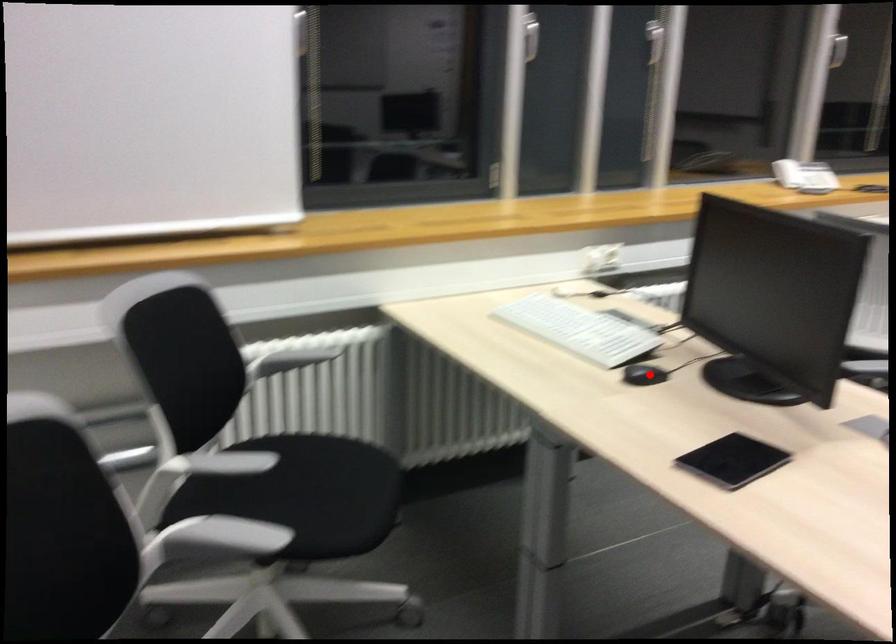
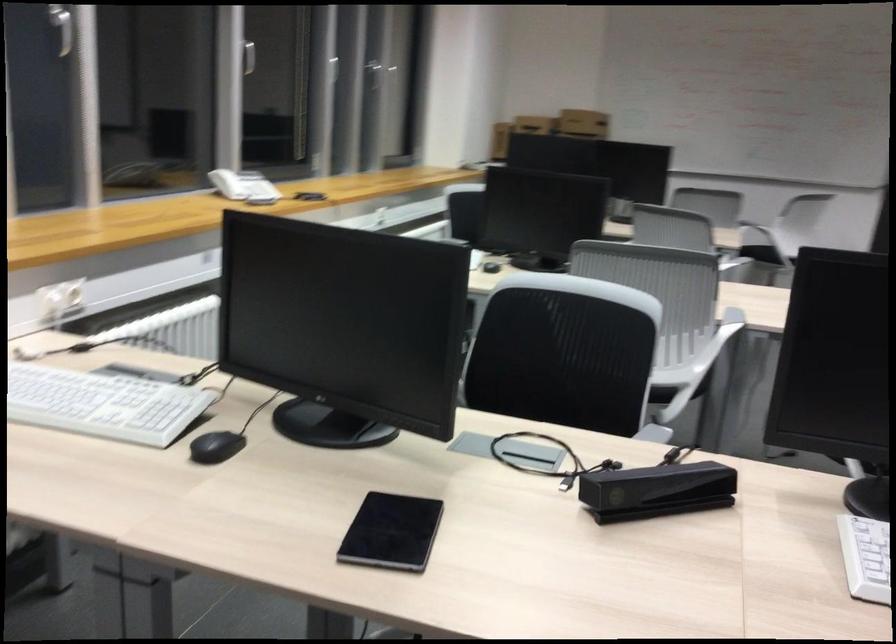
Find the pixel in the second image that matches the highlighted location in the first image.

(216, 447)